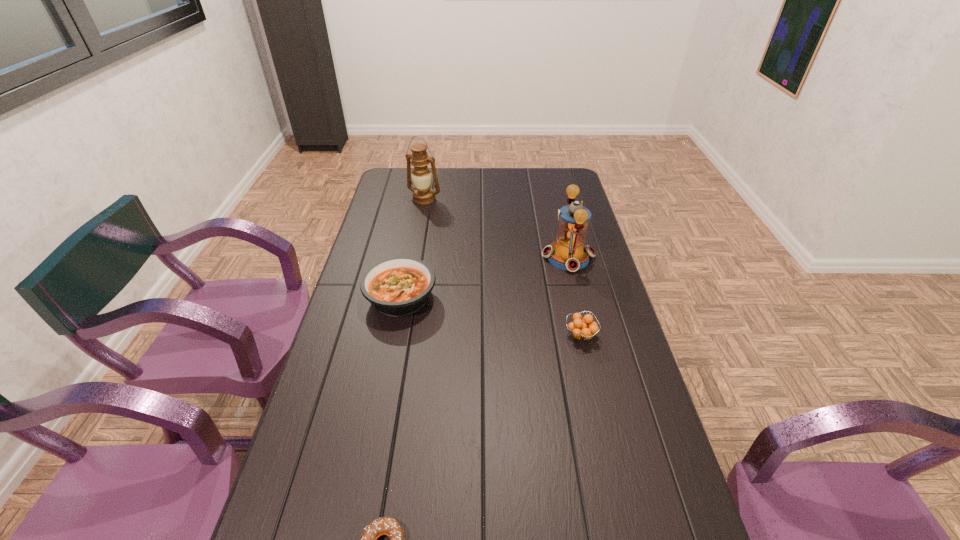
Identify the location of free space between the farthest object and the stew. (413, 249).

This screenshot has height=540, width=960. I want to click on free space between the farthest object and the orange fruit, so point(502,267).

Find the location of `free space between the stew and the lantern`. free space between the stew and the lantern is located at coordinates (485, 278).

In order to click on unoccupied area between the orange fruit and the lantern in this screenshot , I will do `click(574, 296)`.

Locate an element on the screen. The height and width of the screenshot is (540, 960). free space between the oil lamp and the stew is located at coordinates coord(413,249).

You are a GUI agent. You are given a task and a screenshot of the screen. Output one action in this format:
    pyautogui.click(x=<x>, y=<y>)
    Task: Click on the object that stands as the third closest to the doughnut
    This screenshot has height=540, width=960.
    Given the screenshot: What is the action you would take?
    pyautogui.click(x=569, y=253)

Locate which object ranks second in proximity to the orange fruit. Please provide its 2D coordinates. Your answer should be formatted as a tuple, i.e. [(x, y)], where the tuple contains the x and y coordinates of a point satisfying the conditions above.

[(399, 286)]